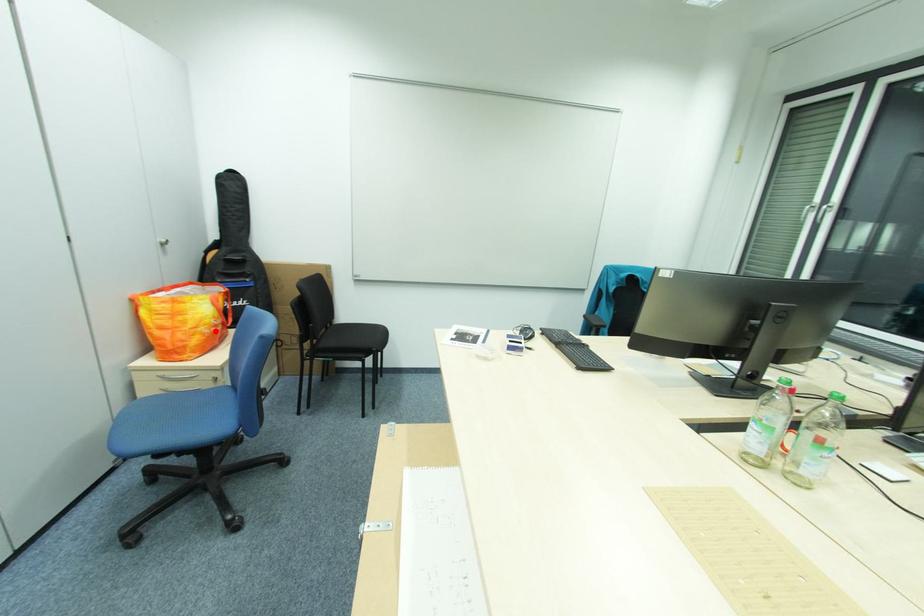
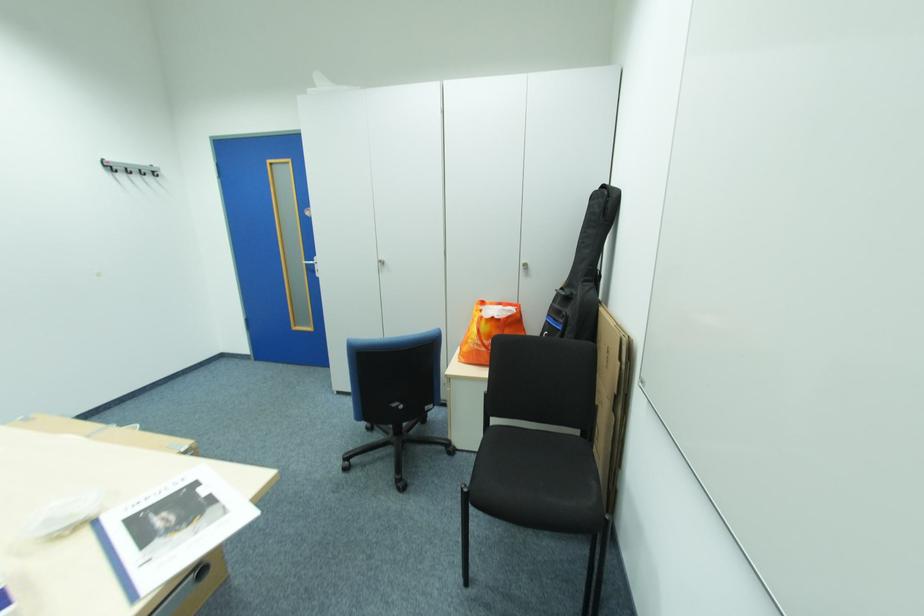
Question: I am providing you with two images of the same scene from different viewpoints. A red point is shown in image1. For the corresponding object point in image2, is it positioned nearer or farther from the camera?

Choices:
 (A) Nearer
 (B) Farther

Answer: (B)